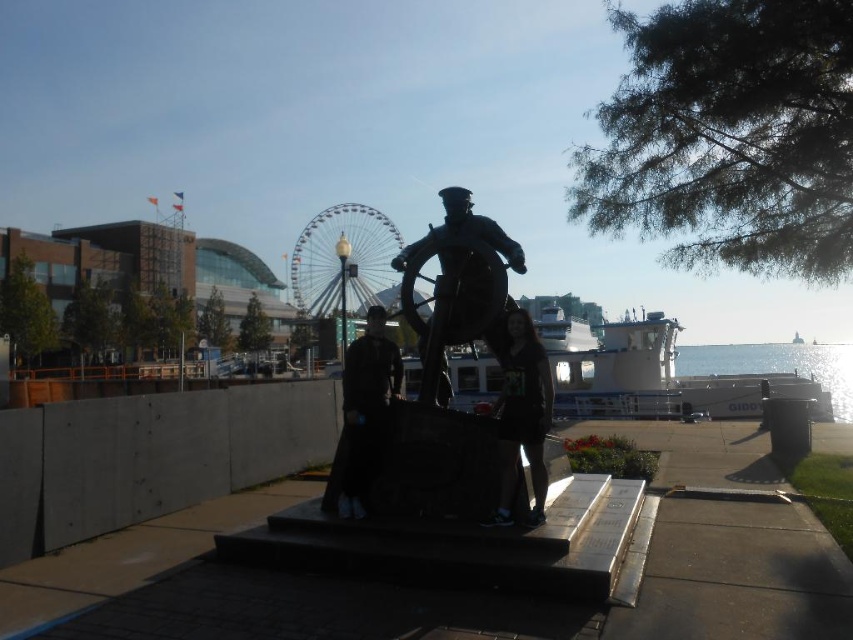
Who is taller, bronze statue at center or dark gray fabric dress at center?

Standing taller between the two is bronze statue at center.

Can you confirm if bronze statue at center is positioned below dark gray fabric dress at center?

Incorrect, bronze statue at center is not positioned below dark gray fabric dress at center.

From the picture: Measure the distance between point (453,268) and camera.

Point (453,268) and camera are 18.39 feet apart.

Locate an element on the screen. The image size is (853, 640). bronze statue at center is located at coordinates (460, 285).

Can you confirm if shiny bronze statue at center is positioned below dark gray fabric jacket at center?

No.

Is shiny bronze statue at center to the left of dark gray fabric jacket at center from the viewer's perspective?

In fact, shiny bronze statue at center is to the right of dark gray fabric jacket at center.

What do you see at coordinates (459, 289) in the screenshot? The image size is (853, 640). I see `shiny bronze statue at center` at bounding box center [459, 289].

Find the location of a particular element. The height and width of the screenshot is (640, 853). shiny bronze statue at center is located at coordinates (459, 289).

Is dark gray fabric jacket at center below glistening silver water at lower right?

Incorrect, dark gray fabric jacket at center is not positioned below glistening silver water at lower right.

Is dark gray fabric jacket at center wider than glistening silver water at lower right?

No, dark gray fabric jacket at center is not wider than glistening silver water at lower right.

Locate an element on the screen. dark gray fabric jacket at center is located at coordinates pos(366,408).